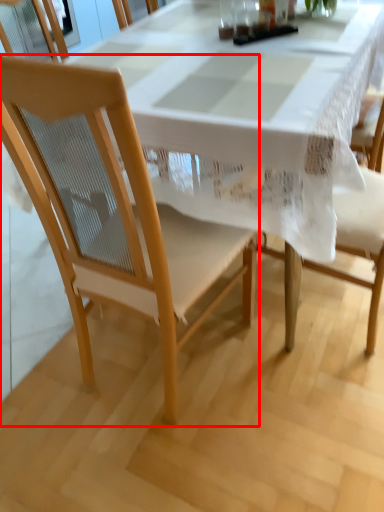
Question: From the image's perspective, considering the relative positions of chair (annotated by the red box) and tablecloth in the image provided, where is chair (annotated by the red box) located with respect to the staircase?

Choices:
 (A) above
 (B) below

Answer: (B)